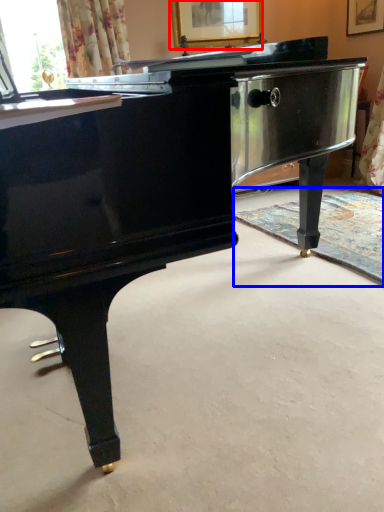
Question: Which object appears closest to the camera in this image, picture frame (highlighted by a red box) or flat (highlighted by a blue box)?

Choices:
 (A) picture frame
 (B) flat

Answer: (B)